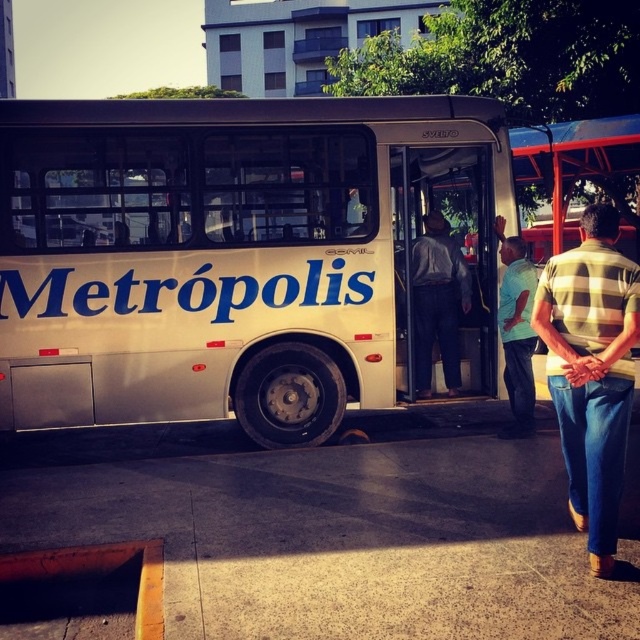
Question: Estimate the real-world distances between objects in this image. Which object is closer to the yellow-green striped shirt at right?

Choices:
 (A) dark gray pants at center
 (B) light blue shirt at center
 (C) white metallic bus at center

Answer: (B)

Question: Can you confirm if yellow-green striped shirt at right is positioned to the left of dark gray pants at center?

Choices:
 (A) no
 (B) yes

Answer: (A)

Question: Which is nearer to the white metallic bus at center?

Choices:
 (A) dark gray pants at center
 (B) yellow-green striped shirt at right

Answer: (A)

Question: Where is white metallic bus at center located in relation to dark gray pants at center in the image?

Choices:
 (A) right
 (B) left

Answer: (B)

Question: Observing the image, what is the correct spatial positioning of white metallic bus at center in reference to dark gray pants at center?

Choices:
 (A) right
 (B) left

Answer: (B)

Question: Considering the real-world distances, which object is farthest from the yellow-green striped shirt at right?

Choices:
 (A) white metallic bus at center
 (B) light blue shirt at center

Answer: (A)